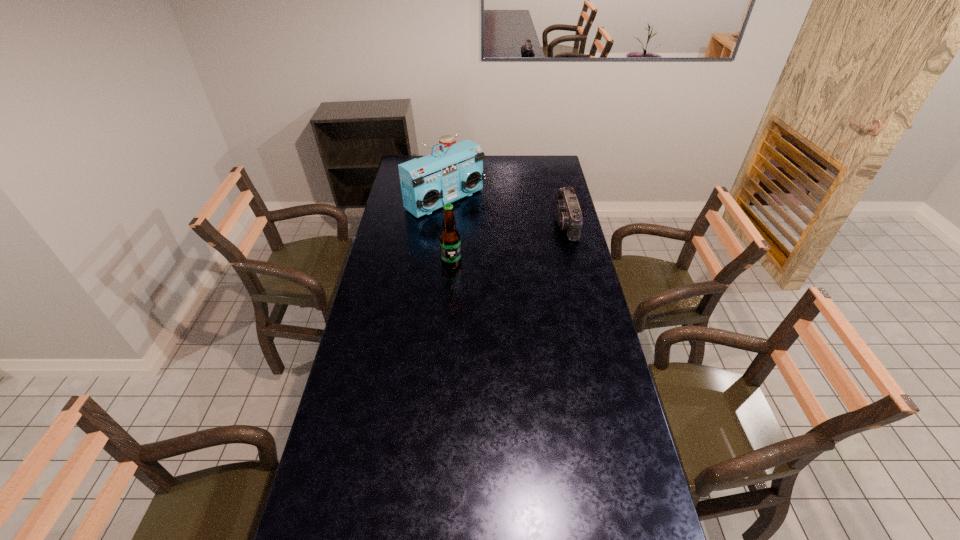
Locate an element on the screen. This screenshot has width=960, height=540. the second tallest object is located at coordinates (450, 242).

Where is `the nearest object`? the nearest object is located at coordinates (450, 242).

The height and width of the screenshot is (540, 960). What are the coordinates of `the rightmost object` in the screenshot? It's located at (569, 217).

The width and height of the screenshot is (960, 540). I want to click on radio receiver, so click(428, 183).

What are the coordinates of `can` in the screenshot? It's located at click(x=446, y=140).

Locate an element on the screen. This screenshot has height=540, width=960. vacant point located 0.200m on the label of the nearest object is located at coordinates (x=448, y=305).

You are a GUI agent. You are given a task and a screenshot of the screen. Output one action in this format:
    pyautogui.click(x=<x>, y=<y>)
    Task: Click on the vacant space located 0.240m on the front-facing side of the rightmost object
    This screenshot has height=540, width=960.
    Given the screenshot: What is the action you would take?
    pyautogui.click(x=505, y=224)

You are a GUI agent. You are given a task and a screenshot of the screen. Output one action in this format:
    pyautogui.click(x=<x>, y=<y>)
    Task: Click on the free space located on the front-facing side of the rightmost object
    
    Given the screenshot: What is the action you would take?
    pyautogui.click(x=524, y=224)

What are the coordinates of `free spot located on the front-facing side of the rightmost object` in the screenshot? It's located at (541, 224).

Where is `free spot located on the front-facing side of the radio receiver`? The height and width of the screenshot is (540, 960). free spot located on the front-facing side of the radio receiver is located at coordinates (502, 239).